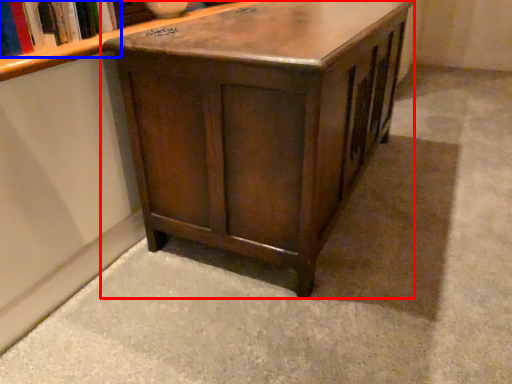
Question: Which point is closer to the camera, table (highlighted by a red box) or book (highlighted by a blue box)?

Choices:
 (A) table
 (B) book

Answer: (A)